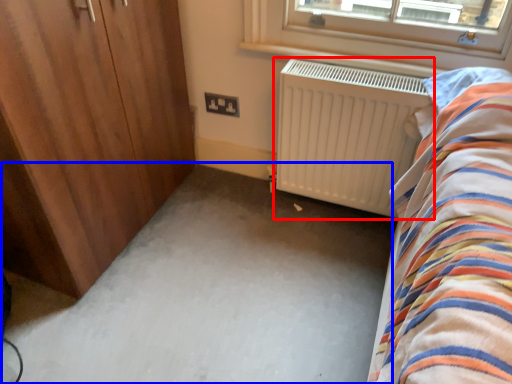
Question: Among these objects, which one is farthest to the camera, radiator (highlighted by a red box) or plain (highlighted by a blue box)?

Choices:
 (A) radiator
 (B) plain

Answer: (A)